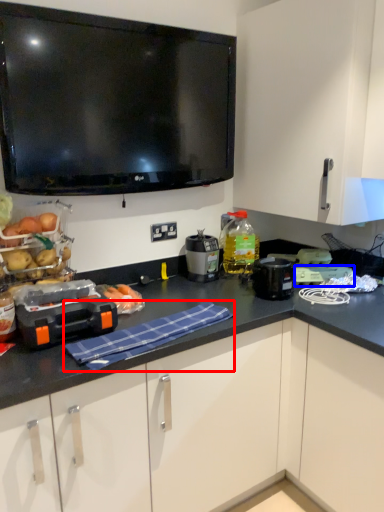
Question: Which object is further to the camera taking this photo, cloth (highlighted by a red box) or appliance (highlighted by a blue box)?

Choices:
 (A) cloth
 (B) appliance

Answer: (B)